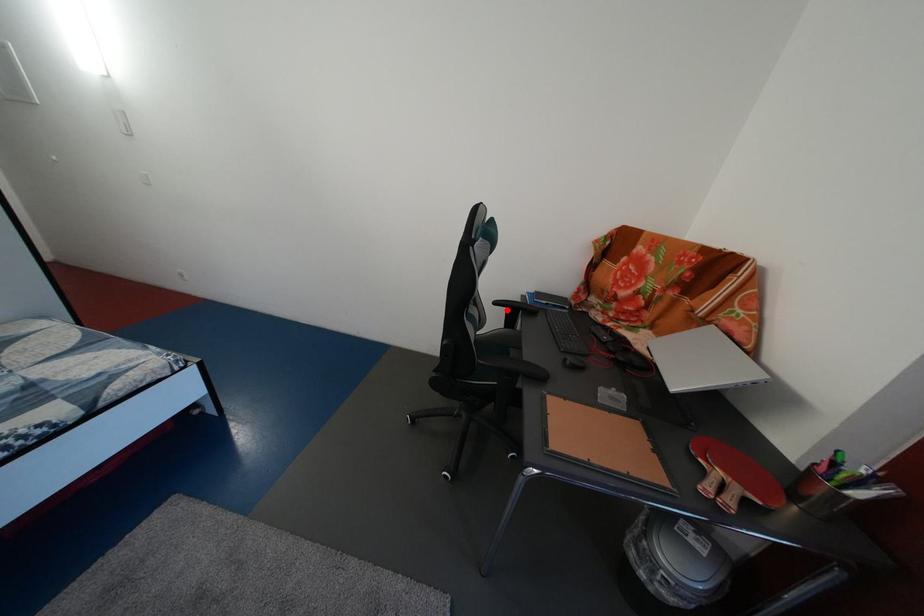
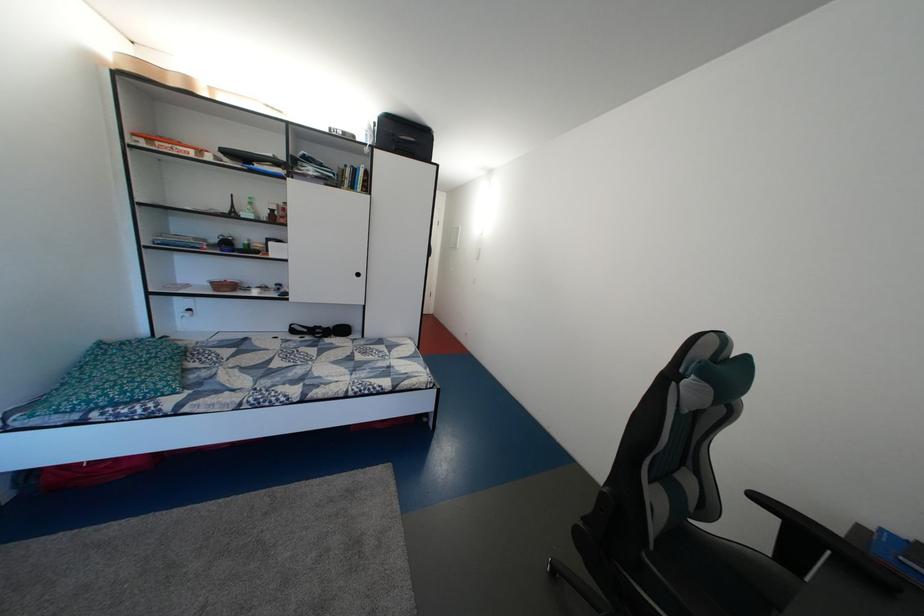
Locate, in the second image, the point that corresponds to the highlighted location in the first image.

(768, 504)